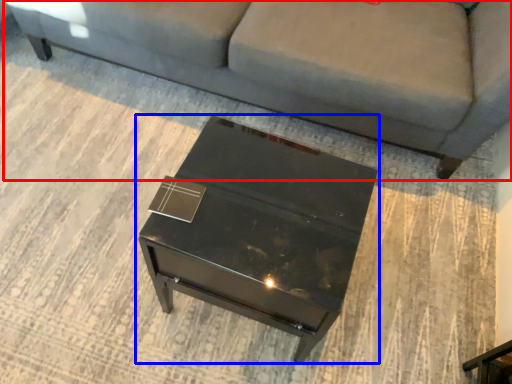
Question: Which of the following is the farthest to the observer, studio couch (highlighted by a red box) or table (highlighted by a blue box)?

Choices:
 (A) studio couch
 (B) table

Answer: (A)